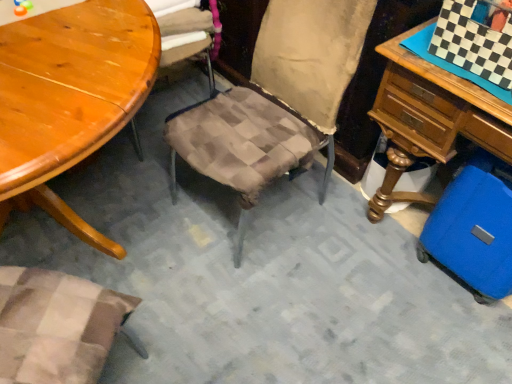
Question: Based on their sizes in the image, would you say blue hardshell suitcase at lower right is bigger or smaller than wooden table at upper left?

Choices:
 (A) small
 (B) big

Answer: (A)

Question: Choose the correct answer: Is blue hardshell suitcase at lower right inside wooden table at upper left or outside it?

Choices:
 (A) inside
 (B) outside

Answer: (B)

Question: From the image's perspective, is blue hardshell suitcase at lower right positioned above or below wooden table at upper left?

Choices:
 (A) above
 (B) below

Answer: (A)

Question: Would you say wooden table at upper left is inside or outside blue hardshell suitcase at lower right?

Choices:
 (A) inside
 (B) outside

Answer: (B)

Question: Looking at the image, does wooden table at upper left seem bigger or smaller compared to blue hardshell suitcase at lower right?

Choices:
 (A) small
 (B) big

Answer: (B)

Question: Considering their positions, is wooden table at upper left located in front of or behind blue hardshell suitcase at lower right?

Choices:
 (A) behind
 (B) front

Answer: (B)

Question: Does point (42, 26) appear closer or farther from the camera than point (455, 240)?

Choices:
 (A) closer
 (B) farther

Answer: (A)